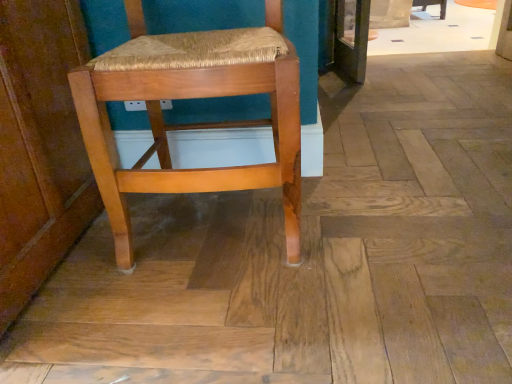
How much space does wooden chair at center, which appears as the first chair when viewed from the right, occupy vertically?

The height of wooden chair at center, which appears as the first chair when viewed from the right, is 9.67 inches.

What are the coordinates of `wooden chair at center, which is counted as the 1th chair, starting from the back` in the screenshot? It's located at (432, 4).

What do you see at coordinates (432, 4) in the screenshot? This screenshot has width=512, height=384. I see `wooden chair at center, which is counted as the 1th chair, starting from the back` at bounding box center [432, 4].

Measure the distance between point (443, 6) and camera.

The distance of point (443, 6) from camera is 3.36 meters.

Identify the location of wooden woven seat at center, positioned as the second chair in right-to-left order. The width and height of the screenshot is (512, 384). (194, 123).

What do you see at coordinates (194, 123) in the screenshot? Image resolution: width=512 pixels, height=384 pixels. I see `wooden woven seat at center, which is the second chair from top to bottom` at bounding box center [194, 123].

Find the location of a particular element. The image size is (512, 384). wooden chair at center, positioned as the second chair in bottom-to-top order is located at coordinates (432, 4).

Considering the positions of objects wooden woven seat at center, the second chair from the back, and wooden chair at center, which appears as the first chair when viewed from the right, in the image provided, who is more to the right, wooden woven seat at center, the second chair from the back, or wooden chair at center, which appears as the first chair when viewed from the right,?

Positioned to the right is wooden chair at center, which appears as the first chair when viewed from the right.

Is wooden woven seat at center, positioned as the second chair in right-to-left order, in front of wooden chair at center, positioned as the second chair in bottom-to-top order?

Yes.

Is point (93, 96) farther from camera compared to point (440, 9)?

No, (93, 96) is in front of (440, 9).

From the image's perspective, relative to wooden chair at center, which appears as the second chair when viewed from the left, is wooden woven seat at center, arranged as the 1th chair when ordered from the bottom, above or below?

wooden woven seat at center, arranged as the 1th chair when ordered from the bottom, is situated lower than wooden chair at center, which appears as the second chair when viewed from the left, in the image.

From a real-world perspective, is wooden woven seat at center, which is the second chair from top to bottom, physically located above or below wooden chair at center, the 2th chair positioned from the front?

wooden woven seat at center, which is the second chair from top to bottom, is situated higher than wooden chair at center, the 2th chair positioned from the front, in the real world.

Is wooden woven seat at center, the second chair from the back, thinner than wooden chair at center, which is counted as the 1th chair, starting from the back?

Yes.

Is wooden woven seat at center, which is the second chair from top to bottom, taller or shorter than wooden chair at center, positioned as the first chair in top-to-bottom order?

wooden woven seat at center, which is the second chair from top to bottom, is taller than wooden chair at center, positioned as the first chair in top-to-bottom order.

Does wooden woven seat at center, the second chair from the back, have a larger size compared to wooden chair at center, which appears as the second chair when viewed from the left?

Yes, wooden woven seat at center, the second chair from the back, is bigger than wooden chair at center, which appears as the second chair when viewed from the left.

Is wooden woven seat at center, the second chair from the back, spatially inside wooden chair at center, which appears as the second chair when viewed from the left, or outside of it?

wooden woven seat at center, the second chair from the back, is spatially situated outside wooden chair at center, which appears as the second chair when viewed from the left.

Is wooden woven seat at center, positioned as the second chair in right-to-left order, aimed at wooden chair at center, positioned as the first chair in top-to-bottom order?

No.

Locate an element on the screen. This screenshot has width=512, height=384. chair located behind the wooden woven seat at center, positioned as the second chair in right-to-left order is located at coordinates (432, 4).

Is wooden chair at center, positioned as the second chair in bottom-to-top order, to the right of wooden woven seat at center, the first chair viewed from the left, from the viewer's perspective?

Correct, you'll find wooden chair at center, positioned as the second chair in bottom-to-top order, to the right of wooden woven seat at center, the first chair viewed from the left.

Between wooden chair at center, the 2th chair positioned from the front, and wooden woven seat at center, the second chair from the back, which one is positioned in front?

wooden woven seat at center, the second chair from the back, is closer to the camera.

Which is closer to the camera, (443, 18) or (106, 84)?

The point (106, 84) is closer.

From the image's perspective, is wooden chair at center, positioned as the first chair in top-to-bottom order, located above or below wooden woven seat at center, which is the second chair from top to bottom?

Based on their image positions, wooden chair at center, positioned as the first chair in top-to-bottom order, is located above wooden woven seat at center, which is the second chair from top to bottom.

Looking at this image, from a real-world perspective, which is physically below, wooden chair at center, which appears as the second chair when viewed from the left, or wooden woven seat at center, arranged as the 1th chair when ordered from the bottom?

wooden chair at center, which appears as the second chair when viewed from the left, is physically lower.

Looking at their sizes, would you say wooden chair at center, which is counted as the 1th chair, starting from the back, is wider or thinner than wooden woven seat at center, which is counted as the first chair, starting from the front?

Considering their sizes, wooden chair at center, which is counted as the 1th chair, starting from the back, looks broader than wooden woven seat at center, which is counted as the first chair, starting from the front.

Who is shorter, wooden chair at center, which is counted as the 1th chair, starting from the back, or wooden woven seat at center, positioned as the second chair in right-to-left order?

With less height is wooden chair at center, which is counted as the 1th chair, starting from the back.

Between wooden chair at center, positioned as the second chair in bottom-to-top order, and wooden woven seat at center, the first chair viewed from the left, which one has smaller size?

Smaller between the two is wooden chair at center, positioned as the second chair in bottom-to-top order.

Is wooden chair at center, which appears as the second chair when viewed from the left, inside or outside of wooden woven seat at center, arranged as the 1th chair when ordered from the bottom?

wooden chair at center, which appears as the second chair when viewed from the left, is located beyond the bounds of wooden woven seat at center, arranged as the 1th chair when ordered from the bottom.

Is wooden chair at center, the 2th chair positioned from the front, next to wooden woven seat at center, which is counted as the first chair, starting from the front, and touching it?

wooden chair at center, the 2th chair positioned from the front, is not next to wooden woven seat at center, which is counted as the first chair, starting from the front, and they're not touching.

Based on the photo, could you tell me if wooden chair at center, which is counted as the 1th chair, starting from the back, is facing wooden woven seat at center, the second chair from the back?

Yes, wooden chair at center, which is counted as the 1th chair, starting from the back, is oriented towards wooden woven seat at center, the second chair from the back.

What's the angular difference between wooden chair at center, which appears as the first chair when viewed from the right, and wooden woven seat at center, which is the second chair from top to bottom,'s facing directions?

1.07 degrees separate the facing orientations of wooden chair at center, which appears as the first chair when viewed from the right, and wooden woven seat at center, which is the second chair from top to bottom.

Locate an element on the screen. Image resolution: width=512 pixels, height=384 pixels. chair located on the left of wooden chair at center, which appears as the first chair when viewed from the right is located at coordinates (194, 123).

The width and height of the screenshot is (512, 384). Identify the location of chair in front of the wooden chair at center, positioned as the second chair in bottom-to-top order. (194, 123).

This screenshot has height=384, width=512. Find the location of `chair below the wooden woven seat at center, the second chair from the back (from a real-world perspective)`. chair below the wooden woven seat at center, the second chair from the back (from a real-world perspective) is located at coordinates (432, 4).